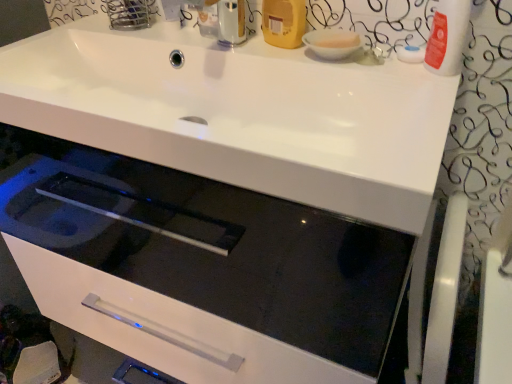
The height and width of the screenshot is (384, 512). Find the location of `vacant space in front of yellow matte plastic bottle at upper right`. vacant space in front of yellow matte plastic bottle at upper right is located at coordinates (301, 61).